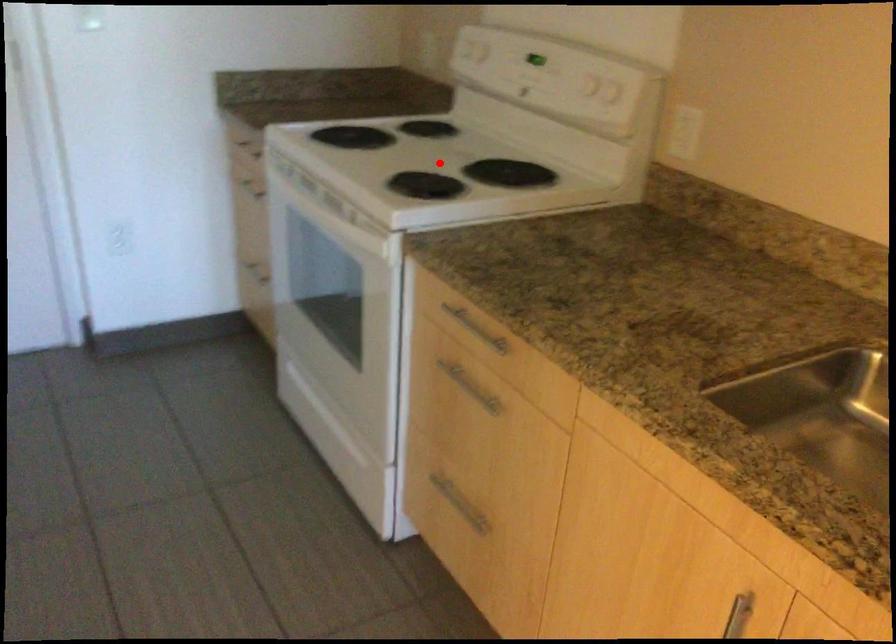
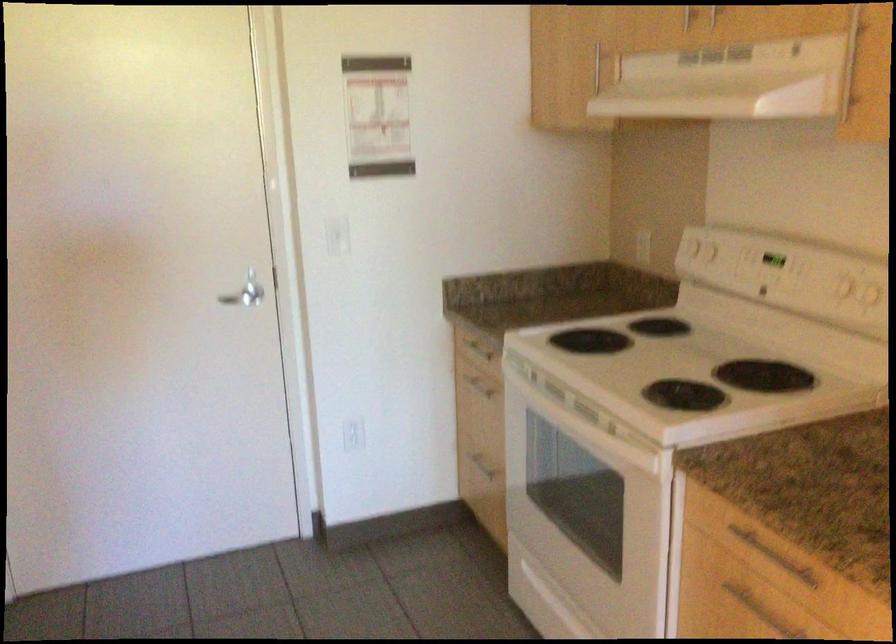
Locate, in the second image, the point that corresponds to the highlighted location in the first image.

(686, 365)